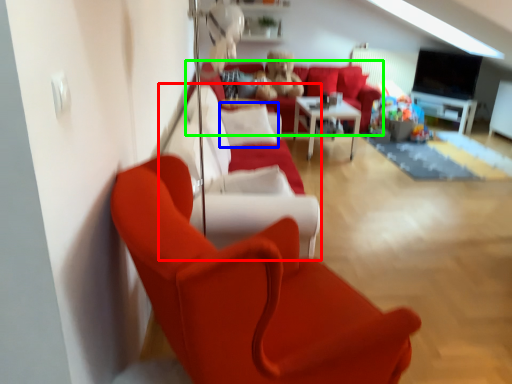
Question: Which object is positioned farthest from couch (highlighted by a red box)? Select from pillow (highlighted by a blue box) and studio couch (highlighted by a green box).

Choices:
 (A) pillow
 (B) studio couch

Answer: (B)